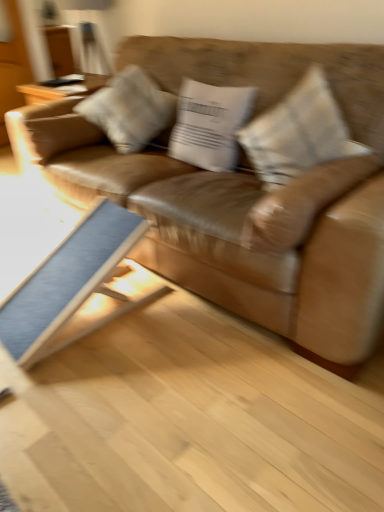
Measure the distance between blue fabric table at lower left and camera.

The distance of blue fabric table at lower left from camera is 1.51 meters.

Measure the distance between point [165,116] and camera.

The distance of point [165,116] from camera is 7.32 feet.

At what (x,y) coordinates should I click in order to perform the action: click on textured beige pillow at center, acting as the 1th pillow starting from the right. Please return your answer as a coordinate pair (x, y). The image size is (384, 512). Looking at the image, I should click on (298, 133).

How much space does textured beige pillow at center, acting as the 1th pillow starting from the right, occupy vertically?

It is 44.96 centimeters.

The width and height of the screenshot is (384, 512). I want to click on white cotton pillow at center, arranged as the second pillow when viewed from the right, so click(209, 124).

Who is more distant, blue fabric table at lower left or brown leather couch at center?

blue fabric table at lower left is more distant.

Is blue fabric table at lower left facing away from brown leather couch at center?

Yes, blue fabric table at lower left is facing away from brown leather couch at center.

Can you confirm if blue fabric table at lower left is bigger than brown leather couch at center?

Incorrect, blue fabric table at lower left is not larger than brown leather couch at center.

From a real-world perspective, relative to brown leather couch at center, is blue fabric table at lower left vertically above or below?

Clearly, from a real-world perspective, blue fabric table at lower left is below brown leather couch at center.

Does textured beige pillow at center, which is the 3th pillow in left-to-right order, have a lesser width compared to brown leather couch at center?

Correct, the width of textured beige pillow at center, which is the 3th pillow in left-to-right order, is less than that of brown leather couch at center.

Is textured beige pillow at center, acting as the 1th pillow starting from the right, positioned with its back to brown leather couch at center?

Yes, brown leather couch at center is at the back of textured beige pillow at center, acting as the 1th pillow starting from the right.

The height and width of the screenshot is (512, 384). I want to click on studio couch below the textured beige pillow at center, which is the 3th pillow in left-to-right order (from a real-world perspective), so click(x=245, y=196).

Is point (234, 131) closer to camera compared to point (99, 324)?

No, (234, 131) is further to viewer.

Do you think white cotton pillow at center, the 2th pillow positioned from the left, is within blue fabric table at lower left, or outside of it?

white cotton pillow at center, the 2th pillow positioned from the left, exists outside the volume of blue fabric table at lower left.

Is white cotton pillow at center, arranged as the second pillow when viewed from the right, oriented away from blue fabric table at lower left?

white cotton pillow at center, arranged as the second pillow when viewed from the right, does not have its back to blue fabric table at lower left.

Considering the positions of objects white cotton pillow at center, arranged as the second pillow when viewed from the right, and brown leather couch at center in the image provided, who is behind, white cotton pillow at center, arranged as the second pillow when viewed from the right, or brown leather couch at center?

white cotton pillow at center, arranged as the second pillow when viewed from the right, is further from the camera.

Consider the image. From the image's perspective, who appears lower, white cotton pillow at center, the 2th pillow positioned from the left, or brown leather couch at center?

From the image's view, brown leather couch at center is below.

Considering the sizes of white cotton pillow at center, the 2th pillow positioned from the left, and brown leather couch at center in the image, is white cotton pillow at center, the 2th pillow positioned from the left, wider or thinner than brown leather couch at center?

white cotton pillow at center, the 2th pillow positioned from the left, is thinner than brown leather couch at center.

Can you confirm if white cotton pillow at center, the 2th pillow positioned from the left, is positioned to the right of brown leather couch at center?

No.

Considering the positions of objects brown leather couch at center and light gray fabric pillow at center, the first pillow in the left-to-right sequence, in the image provided, who is behind, brown leather couch at center or light gray fabric pillow at center, the first pillow in the left-to-right sequence,?

light gray fabric pillow at center, the first pillow in the left-to-right sequence.

Can light gray fabric pillow at center, the first pillow in the left-to-right sequence, be found inside brown leather couch at center?

That's correct, light gray fabric pillow at center, the first pillow in the left-to-right sequence, is inside brown leather couch at center.

Can you see brown leather couch at center touching light gray fabric pillow at center, the first pillow in the left-to-right sequence?

No, brown leather couch at center is not next to light gray fabric pillow at center, the first pillow in the left-to-right sequence.

Can you confirm if brown leather couch at center is thinner than light gray fabric pillow at center, the first pillow in the left-to-right sequence?

Incorrect, the width of brown leather couch at center is not less than that of light gray fabric pillow at center, the first pillow in the left-to-right sequence.

From a real-world perspective, which is physically above, light gray fabric pillow at center, the first pillow in the left-to-right sequence, or blue fabric table at lower left?

In real-world perspective, light gray fabric pillow at center, the first pillow in the left-to-right sequence, is above.

Is light gray fabric pillow at center, the first pillow in the left-to-right sequence, positioned far away from blue fabric table at lower left?

light gray fabric pillow at center, the first pillow in the left-to-right sequence, is near blue fabric table at lower left, not far away.

From the image's perspective, is light gray fabric pillow at center, the first pillow in the left-to-right sequence, above or below blue fabric table at lower left?

Based on their image positions, light gray fabric pillow at center, the first pillow in the left-to-right sequence, is located above blue fabric table at lower left.

Is light gray fabric pillow at center, the first pillow in the left-to-right sequence, oriented away from blue fabric table at lower left?

No, light gray fabric pillow at center, the first pillow in the left-to-right sequence,'s orientation is not away from blue fabric table at lower left.

From a real-world perspective, is blue fabric table at lower left positioned over light gray fabric pillow at center, arranged as the third pillow when viewed from the right, based on gravity?

Incorrect, from a real-world perspective, blue fabric table at lower left is lower than light gray fabric pillow at center, arranged as the third pillow when viewed from the right.

Is blue fabric table at lower left touching light gray fabric pillow at center, the first pillow in the left-to-right sequence?

blue fabric table at lower left and light gray fabric pillow at center, the first pillow in the left-to-right sequence, are not in contact.

Considering the sizes of objects blue fabric table at lower left and light gray fabric pillow at center, the first pillow in the left-to-right sequence, in the image provided, who is shorter, blue fabric table at lower left or light gray fabric pillow at center, the first pillow in the left-to-right sequence,?

blue fabric table at lower left is shorter.

How different are the orientations of blue fabric table at lower left and light gray fabric pillow at center, arranged as the third pillow when viewed from the right, in degrees?

The angular difference between blue fabric table at lower left and light gray fabric pillow at center, arranged as the third pillow when viewed from the right, is 1.25 degrees.

Where is `table on the left of brown leather couch at center`? table on the left of brown leather couch at center is located at coordinates (71, 284).

This screenshot has height=512, width=384. I want to click on pillow on the right of the brown leather couch at center, so click(298, 133).

Estimate the real-world distances between objects in this image. Which object is closer to textured beige pillow at center, acting as the 1th pillow starting from the right, blue fabric table at lower left or brown leather couch at center?

brown leather couch at center is positioned closer to the anchor textured beige pillow at center, acting as the 1th pillow starting from the right.

Looking at the image, which one is located closer to white cotton pillow at center, arranged as the second pillow when viewed from the right, blue fabric table at lower left or textured beige pillow at center, which is the 3th pillow in left-to-right order?

Among the two, textured beige pillow at center, which is the 3th pillow in left-to-right order, is located nearer to white cotton pillow at center, arranged as the second pillow when viewed from the right.

Based on their spatial positions, is textured beige pillow at center, acting as the 1th pillow starting from the right, or brown leather couch at center further from blue fabric table at lower left?

textured beige pillow at center, acting as the 1th pillow starting from the right, is positioned further to the anchor blue fabric table at lower left.

Looking at the image, which one is located closer to textured beige pillow at center, acting as the 1th pillow starting from the right, light gray fabric pillow at center, the first pillow in the left-to-right sequence, or brown leather couch at center?

brown leather couch at center lies closer to textured beige pillow at center, acting as the 1th pillow starting from the right, than the other object.

Which object lies further to the anchor point blue fabric table at lower left, brown leather couch at center or light gray fabric pillow at center, the first pillow in the left-to-right sequence?

light gray fabric pillow at center, the first pillow in the left-to-right sequence, lies further to blue fabric table at lower left than the other object.

Looking at the image, which one is located further to light gray fabric pillow at center, the first pillow in the left-to-right sequence, white cotton pillow at center, arranged as the second pillow when viewed from the right, or blue fabric table at lower left?

blue fabric table at lower left.

Which object lies nearer to the anchor point light gray fabric pillow at center, arranged as the third pillow when viewed from the right, textured beige pillow at center, which is the 3th pillow in left-to-right order, or brown leather couch at center?

brown leather couch at center lies closer to light gray fabric pillow at center, arranged as the third pillow when viewed from the right, than the other object.

Looking at this image, based on their spatial positions, is white cotton pillow at center, the 2th pillow positioned from the left, or blue fabric table at lower left closer to brown leather couch at center?

white cotton pillow at center, the 2th pillow positioned from the left.

The height and width of the screenshot is (512, 384). I want to click on table located between brown leather couch at center and light gray fabric pillow at center, arranged as the third pillow when viewed from the right, in the depth direction, so click(71, 284).

Where is `studio couch between blue fabric table at lower left and textured beige pillow at center, acting as the 1th pillow starting from the right, in the horizontal direction`? This screenshot has height=512, width=384. studio couch between blue fabric table at lower left and textured beige pillow at center, acting as the 1th pillow starting from the right, in the horizontal direction is located at coordinates (245, 196).

Identify the location of table between brown leather couch at center and white cotton pillow at center, the 2th pillow positioned from the left, in the front-back direction. (71, 284).

Identify the location of pillow positioned between brown leather couch at center and white cotton pillow at center, the 2th pillow positioned from the left, from near to far. (298, 133).